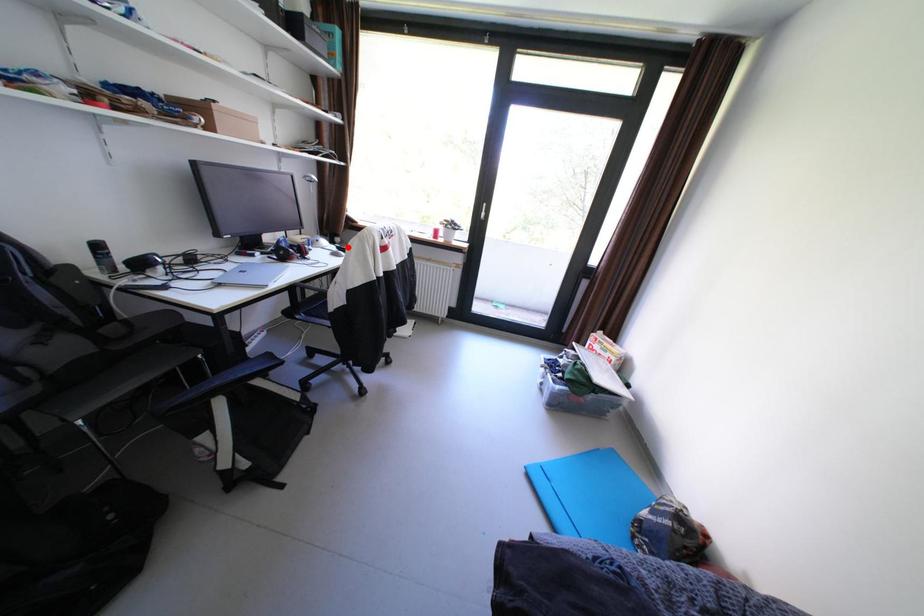
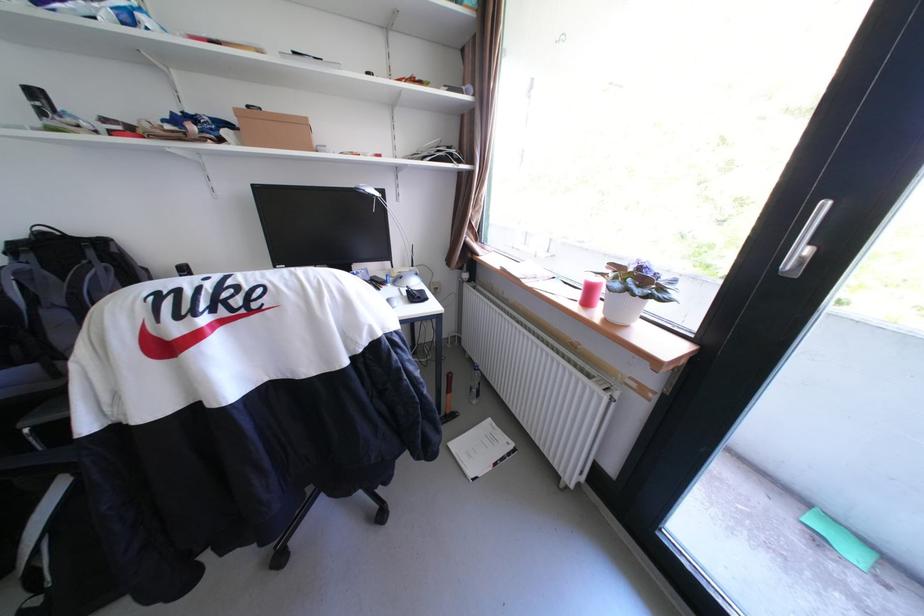
Question: I am providing you with two images of the same scene from different viewpoints. In image1, a red point is highlighted. Considering the same 3D point in image2, which of the following is correct?

Choices:
 (A) It is closer
 (B) It is farther

Answer: (A)